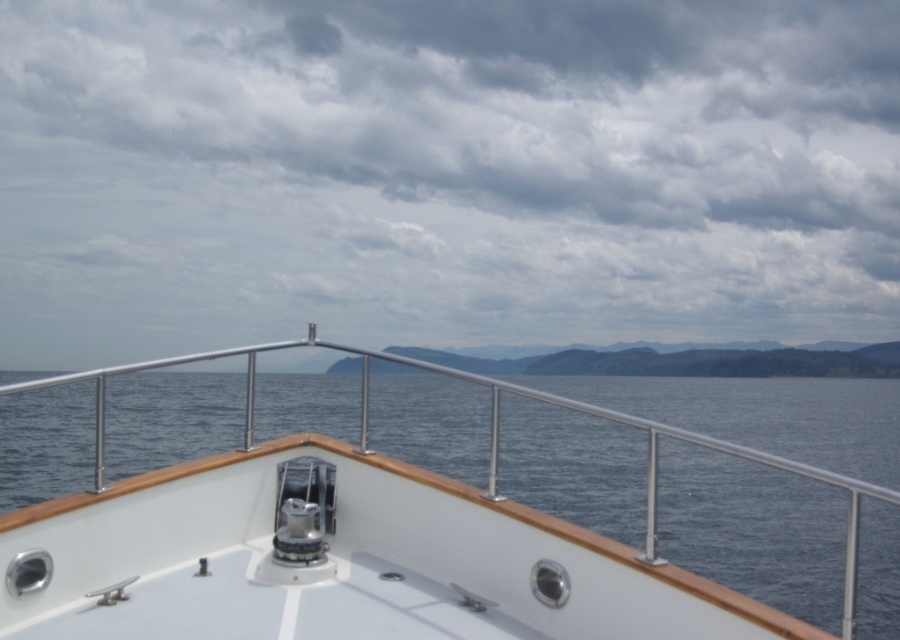
You are standing at the bow of the boat and notice a specific point on the image. What is located at the coordinates point (x=446, y=172)?

At point (x=446, y=172) lies cloudy sky at upper center.